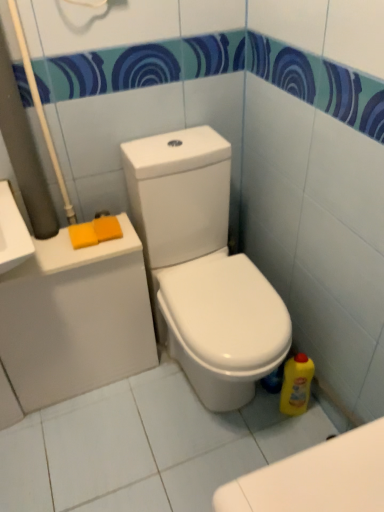
This screenshot has width=384, height=512. Identify the location of vacant area that is in front of orange sponge at left, the 2th soap positioned from the right. (76, 256).